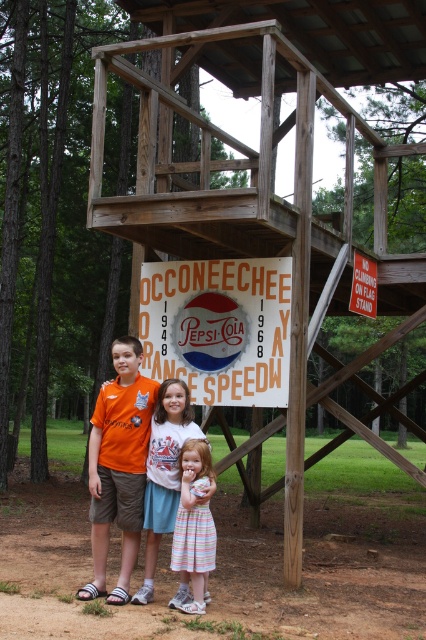
You are standing in front of the wooden observation tower and want to place a small flag at each of the two points marked as point (146, 444) and point (161, 477). Which point is closer to you so that the flag there will be more visible?

Point (146, 444) is closer to you, so the flag placed there will be more visible.